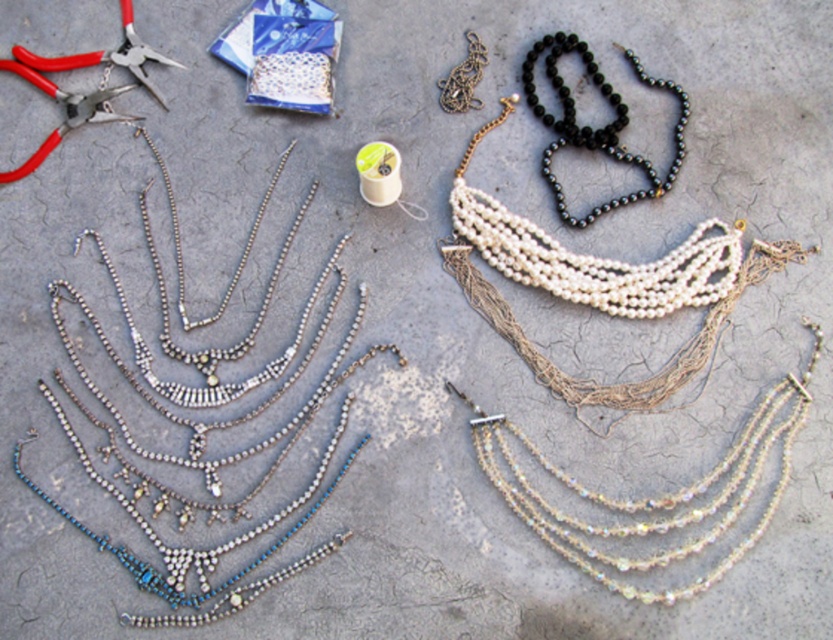
Question: Does white pearl necklace at upper center have a smaller size compared to black beads necklace at upper center?

Choices:
 (A) yes
 (B) no

Answer: (B)

Question: Which is farther from the white pearl necklace at upper center?

Choices:
 (A) black beads necklace at upper center
 (B) silver metallic chain at upper left

Answer: (B)

Question: Is iridescent glass necklace at center below red plastic pliers at upper left?

Choices:
 (A) no
 (B) yes

Answer: (B)

Question: Which of the following is the farthest from the observer?

Choices:
 (A) (667, 179)
 (B) (542, 368)

Answer: (A)

Question: Can you confirm if iridescent glass necklace at center is smaller than black beads necklace at upper center?

Choices:
 (A) yes
 (B) no

Answer: (B)

Question: Among these objects, which one is nearest to the camera?

Choices:
 (A) silver metallic chain at upper left
 (B) white pearl necklace at upper center

Answer: (A)